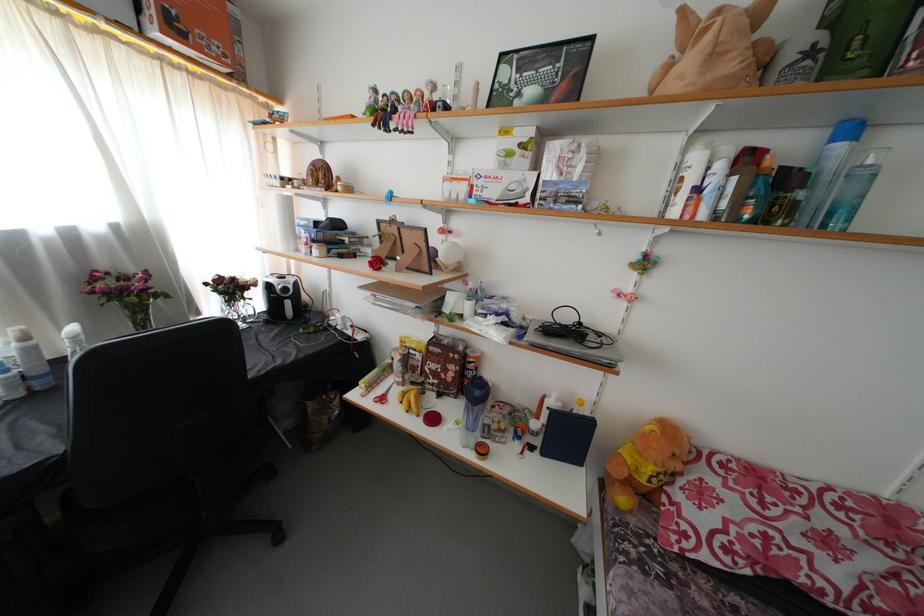
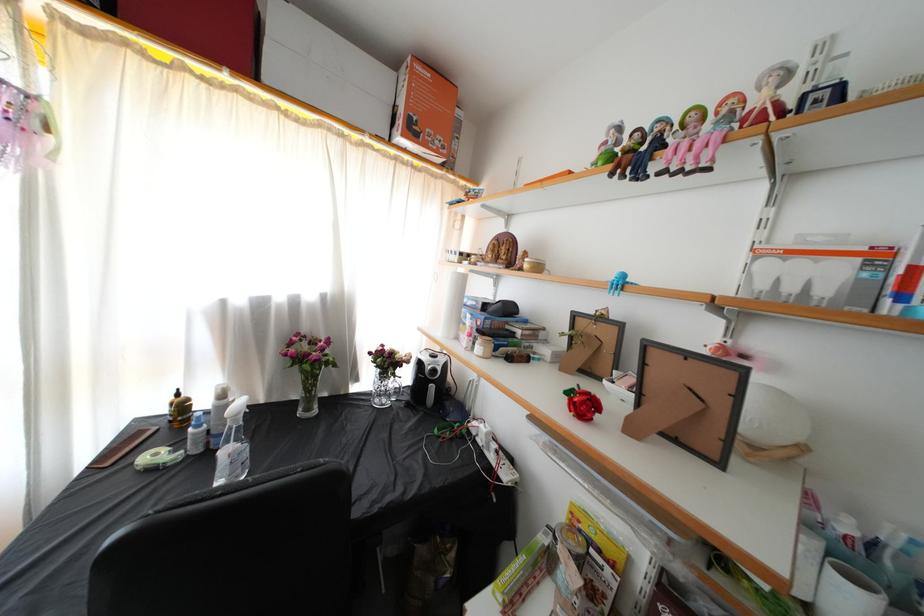
The point at (37,349) is marked in the first image. Where is the corresponding point in the second image?

(229, 407)